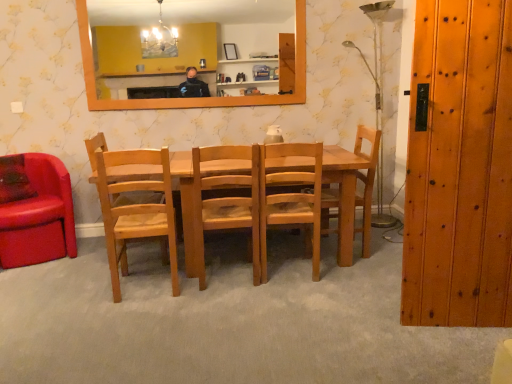
You are a GUI agent. You are given a task and a screenshot of the screen. Output one action in this format:
    pyautogui.click(x=<x>, y=<y>)
    Task: Click on the vacant area located to the right-hand side of light brown wood chair at center, marked as the 4th chair in a left-to-right arrangement
    
    Given the screenshot: What is the action you would take?
    pyautogui.click(x=345, y=270)